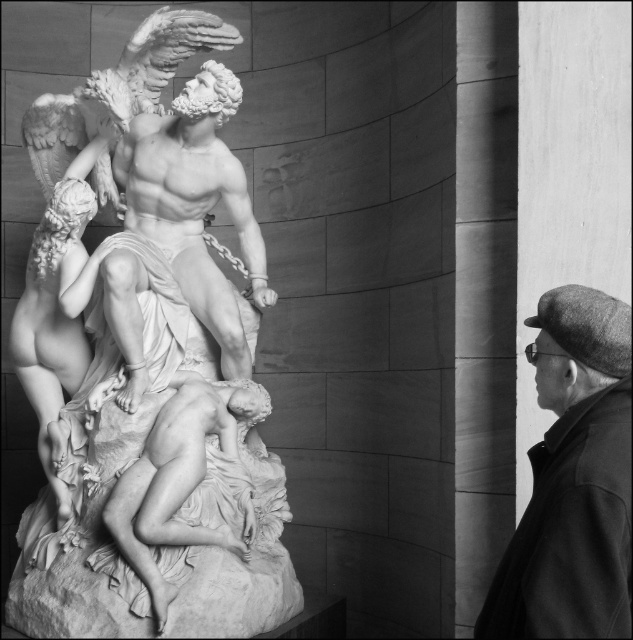
Question: Which point is closer to the camera taking this photo?

Choices:
 (A) (622, 545)
 (B) (53, 205)
 (C) (104, 266)

Answer: (A)

Question: Does white marble statue at center appear over white marble reclining figure at center?

Choices:
 (A) no
 (B) yes

Answer: (B)

Question: Considering the relative positions of white marble sculpture at center and white marble reclining figure at center in the image provided, where is white marble sculpture at center located with respect to white marble reclining figure at center?

Choices:
 (A) above
 (B) below

Answer: (A)

Question: Is white marble sculpture at center to the right of white marble statue at center from the viewer's perspective?

Choices:
 (A) yes
 (B) no

Answer: (B)

Question: Which object is positioned farthest from the dark gray woolen cap at upper right?

Choices:
 (A) white marble statue at center
 (B) white marble sculpture at center

Answer: (A)

Question: Which of the following is the farthest from the observer?

Choices:
 (A) (246, 477)
 (B) (156, 564)
 (C) (580, 460)

Answer: (A)